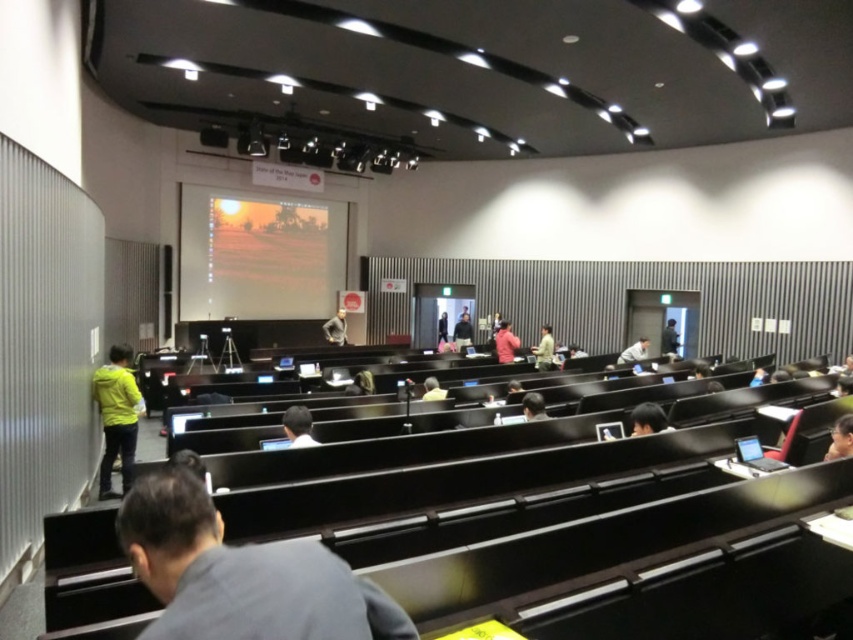
You are sitting in the audience of the lecture hall and notice two presenters on stage wearing dark gray shirt at center and light blue shirt at center. Which presenter is positioned to the left when viewed from your seat?

The dark gray shirt at center is positioned to the left of the light blue shirt at center, so the presenter in the dark gray shirt at center is on the left.

You are sitting in the lecture hall and want to move from your current position to the front of the stage. There are two points marked in the room. Which point should you walk towards to get closer to the stage faster? The points are point (262, 563) and point (315, 444).

You should walk towards point (262, 563) because it is in front of point (315, 444), meaning it is closer to the stage.